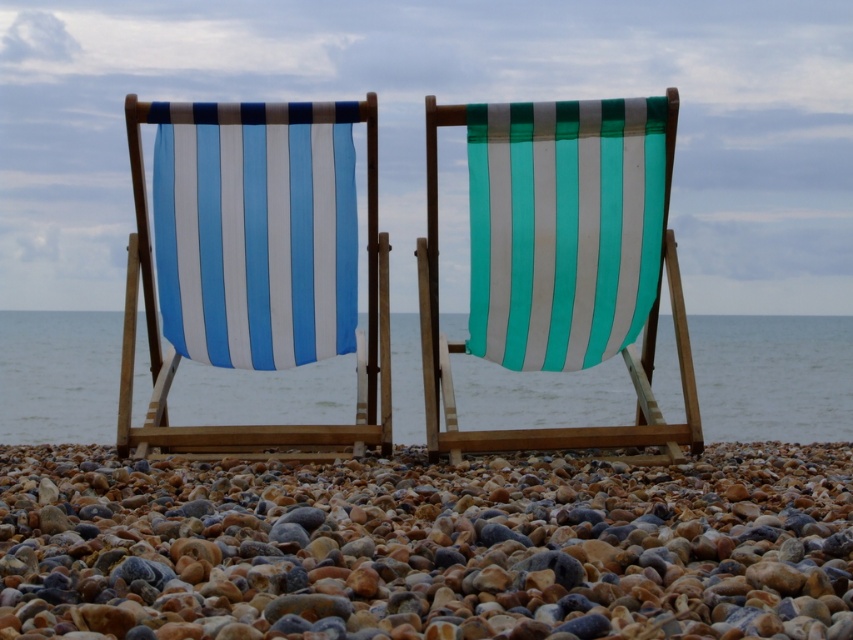
You are standing on the pebble beach and see the teal striped fabric chair at center and the blue striped fabric at left. Which one appears closer to you?

The teal striped fabric chair at center appears closer because it is positioned in front of the blue striped fabric at left.

You are standing at the edge of the beach looking towards the two wooden deck chairs. You notice two points marked on the ground in front of you. One is at coordinate point (547, 465) and the other is at point (372, 225). Which of these two points is nearer to your current position?

Point (547, 465) is closer to the camera than point (372, 225), so the point at coordinate (547, 465) is nearer to your current position.

You are standing on the pebble beach and want to place a small potted plant exactly where the point marked at coordinates (427,547) is located. According to the scene description, what type of pebbles will the potted plant be placed on?

The point marked at coordinates (427,547) is where the smooth pebbles at center are located, so the potted plant will be placed on smooth pebbles.